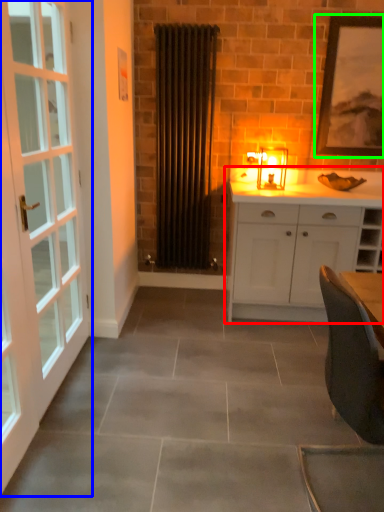
Question: Considering the real-world distances, which object is closest to cabinetry (highlighted by a red box)? door (highlighted by a blue box) or picture frame (highlighted by a green box).

Choices:
 (A) door
 (B) picture frame

Answer: (B)